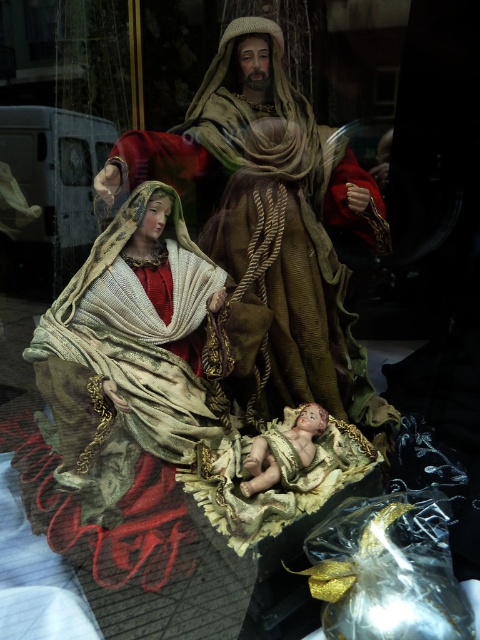
Where is the velvet brown robe at center located in the image?

The velvet brown robe at center is located at point (285,211).

You are an observer standing in front of the nativity scene. You notice the velvet brown robe at center and the smooth porcelain baby at center. Which object is closer to you?

The velvet brown robe at center is closer to you than the smooth porcelain baby at center, so the velvet brown robe at center is closer.

In the nativity scene, you notice the velvet brown robe at center and the smooth porcelain baby at center. Which object takes up more space in the image?

The velvet brown robe at center is bigger than the smooth porcelain baby at center, so it takes up more space in the image.